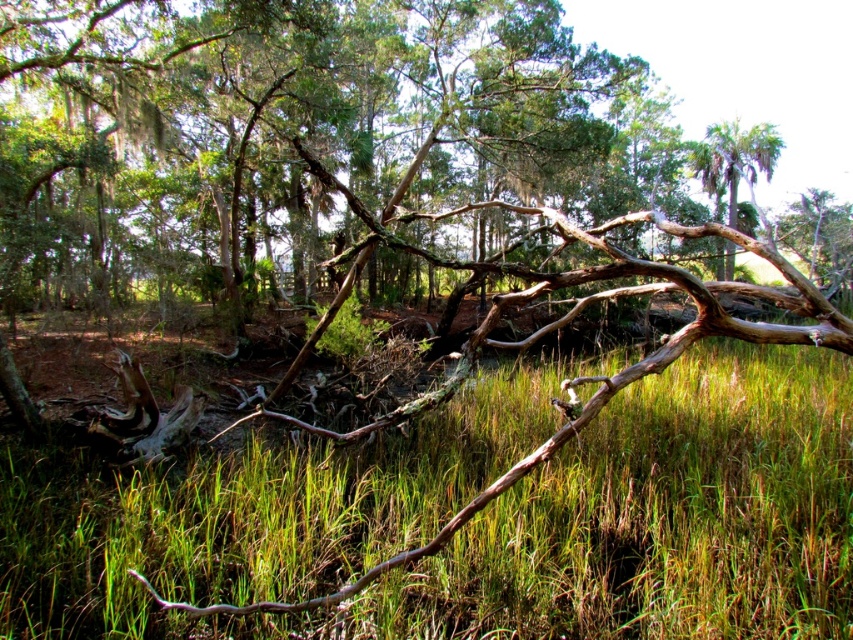
Looking at this image, you are standing in the forest and want to walk from the point at coordinates point (509,636) to the point at coordinates point (709,180). Which direction should you face to move towards the farther point?

You should face away from the viewer because point (709,180) is farther from the viewer than point (509,636).